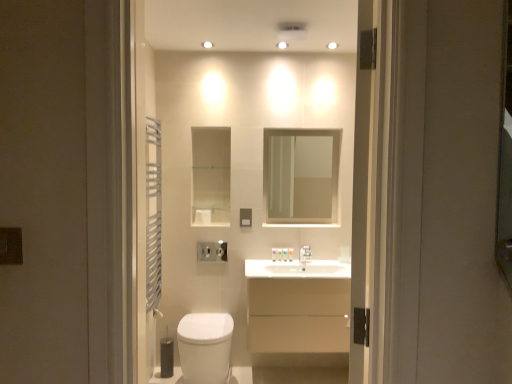
Question: Is point (248, 226) closer or farther from the camera than point (206, 223)?

Choices:
 (A) closer
 (B) farther

Answer: (A)

Question: Considering the positions of matte gray electric outlet at center, the 1th electric outlet viewed from the back, and white matte toilet paper at center, which is counted as the 2th toilet paper, starting from the bottom, in the image, is matte gray electric outlet at center, the 1th electric outlet viewed from the back, taller or shorter than white matte toilet paper at center, which is counted as the 2th toilet paper, starting from the bottom,?

Choices:
 (A) short
 (B) tall

Answer: (B)

Question: Estimate the real-world distances between objects in this image. Which object is closer to the clear glass mirror at upper center?

Choices:
 (A) white matte toilet paper at right, the first toilet paper positioned from the right
 (B) white glossy sink at center
 (C) beige matte cabinet at center
 (D) matte gray electric outlet at center, the second electric outlet when ordered from left to right
 (E) matte black switch at left, which is the first electric outlet in front-to-back order

Answer: (A)

Question: Which object is positioned farthest from the white matte toilet paper at center, which is counted as the 2th toilet paper, starting from the bottom?

Choices:
 (A) matte black switch at left, which is the first electric outlet in front-to-back order
 (B) white glossy toilet at center
 (C) white glossy toilet at lower center
 (D) white matte toilet paper at right, which is the 1th toilet paper from bottom to top
 (E) white glossy sink at center

Answer: (A)